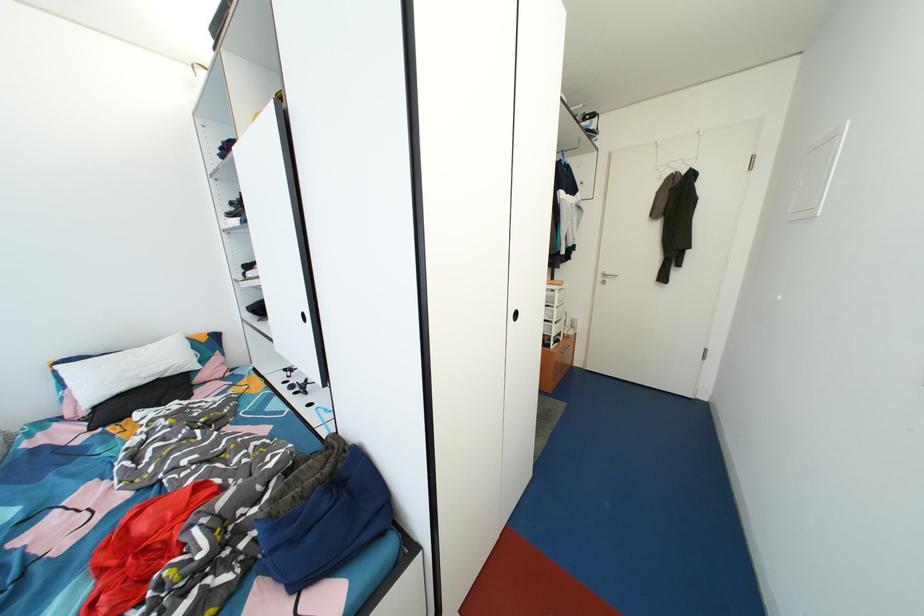
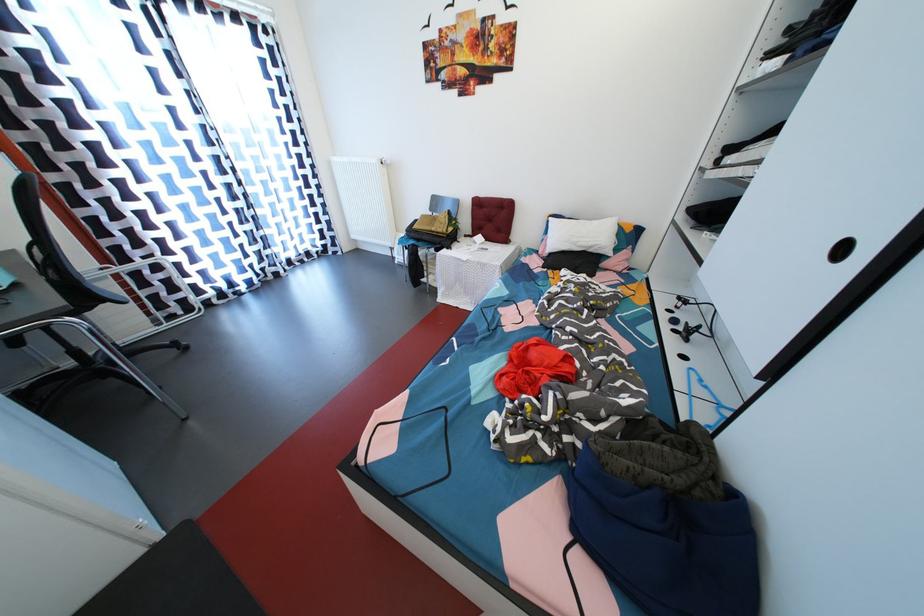
Where in the second image is the point corresponding to the point at 167,373 from the first image?

(597, 249)